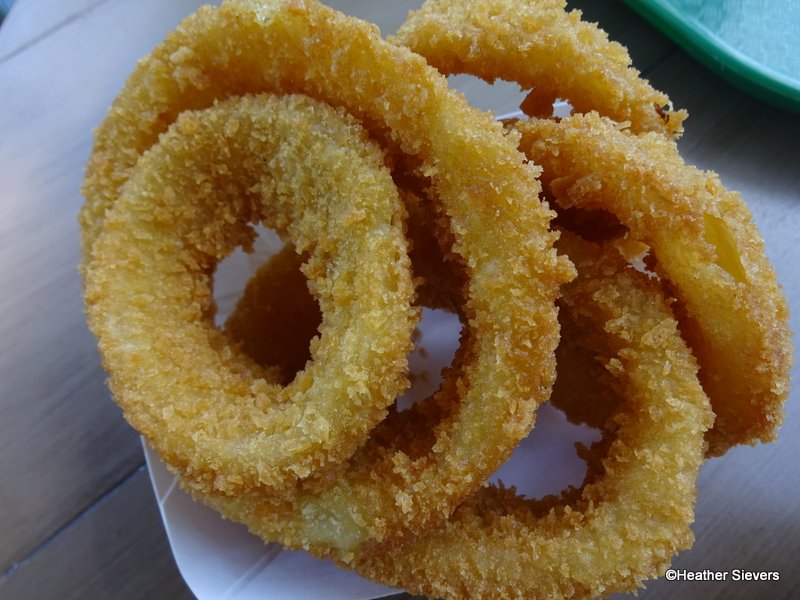
Where is `white dish holding onion rings`? The height and width of the screenshot is (600, 800). white dish holding onion rings is located at coordinates (240, 576).